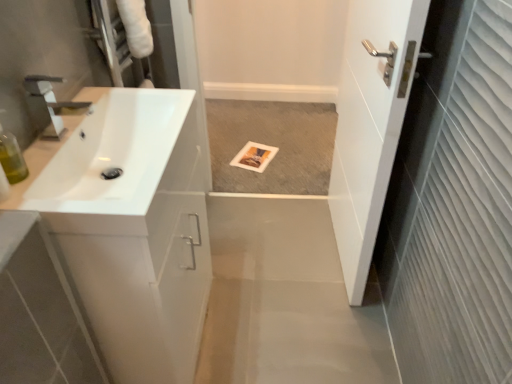
Question: Is white glossy sink at left behind translucent green bottle at left?

Choices:
 (A) no
 (B) yes

Answer: (B)

Question: Is white glossy sink at left positioned before translucent green bottle at left?

Choices:
 (A) no
 (B) yes

Answer: (A)

Question: Could translucent green bottle at left be considered to be inside white glossy sink at left?

Choices:
 (A) yes
 (B) no

Answer: (B)

Question: From a real-world perspective, is white glossy sink at left on translucent green bottle at left?

Choices:
 (A) no
 (B) yes

Answer: (A)

Question: Is white glossy sink at left to the left of translucent green bottle at left from the viewer's perspective?

Choices:
 (A) yes
 (B) no

Answer: (B)

Question: Is white glossy sink at left spatially inside white glossy sink at left, or outside of it?

Choices:
 (A) outside
 (B) inside

Answer: (A)

Question: In the image, is white glossy sink at left positioned in front of or behind white glossy sink at left?

Choices:
 (A) front
 (B) behind

Answer: (A)

Question: In the image, is white glossy sink at left on the left side or the right side of white glossy sink at left?

Choices:
 (A) right
 (B) left

Answer: (B)

Question: Considering the positions of white glossy sink at left and white glossy sink at left in the image, is white glossy sink at left bigger or smaller than white glossy sink at left?

Choices:
 (A) big
 (B) small

Answer: (B)

Question: Relative to white glossy door at right, is translucent green bottle at left in front or behind?

Choices:
 (A) behind
 (B) front

Answer: (B)

Question: From the image's perspective, is translucent green bottle at left positioned above or below white glossy door at right?

Choices:
 (A) below
 (B) above

Answer: (A)

Question: Looking at their shapes, would you say translucent green bottle at left is wider or thinner than white glossy door at right?

Choices:
 (A) thin
 (B) wide

Answer: (A)

Question: From a real-world perspective, is translucent green bottle at left above or below white glossy door at right?

Choices:
 (A) above
 (B) below

Answer: (A)

Question: Based on their positions, is white glossy door at right located to the left or right of translucent green bottle at left?

Choices:
 (A) right
 (B) left

Answer: (A)

Question: Is white glossy door at right situated inside translucent green bottle at left or outside?

Choices:
 (A) inside
 (B) outside

Answer: (B)